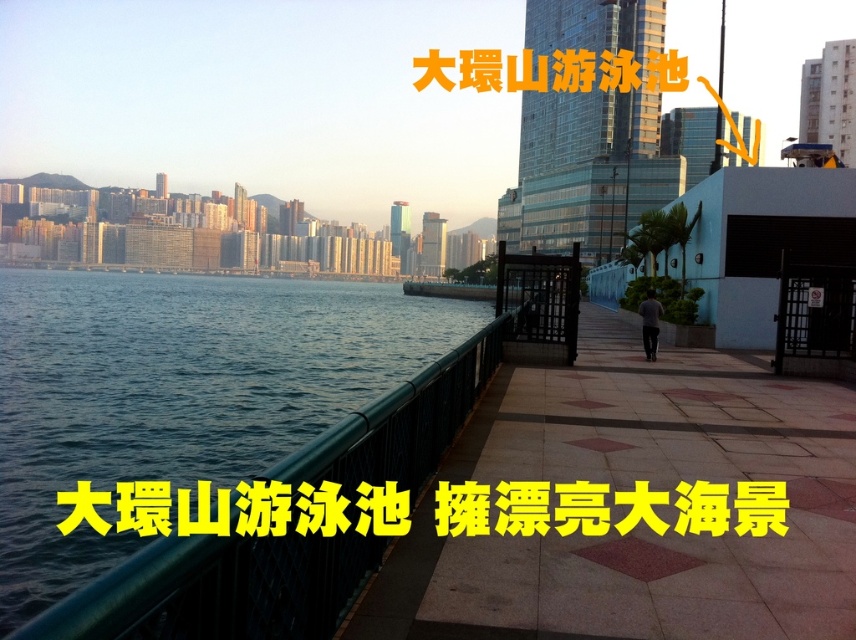
Question: Estimate the real-world distances between objects in this image. Which object is closer to the yellow text at upper center?

Choices:
 (A) green metallic railing at lower left
 (B) green metal railing at left

Answer: (B)

Question: Observing the image, what is the correct spatial positioning of green metal railing at left in reference to green metallic railing at lower left?

Choices:
 (A) above
 (B) below

Answer: (B)

Question: Can you confirm if green metal railing at left is positioned below yellow text at upper center?

Choices:
 (A) no
 (B) yes

Answer: (A)

Question: Based on their relative distances, which object is nearer to the green metallic railing at lower left?

Choices:
 (A) green metal railing at left
 (B) yellow text at upper center

Answer: (A)

Question: Does green metal railing at left appear over yellow text at upper center?

Choices:
 (A) yes
 (B) no

Answer: (A)

Question: Estimate the real-world distances between objects in this image. Which object is closer to the yellow text at upper center?

Choices:
 (A) green metallic railing at lower left
 (B) green metal railing at left

Answer: (B)